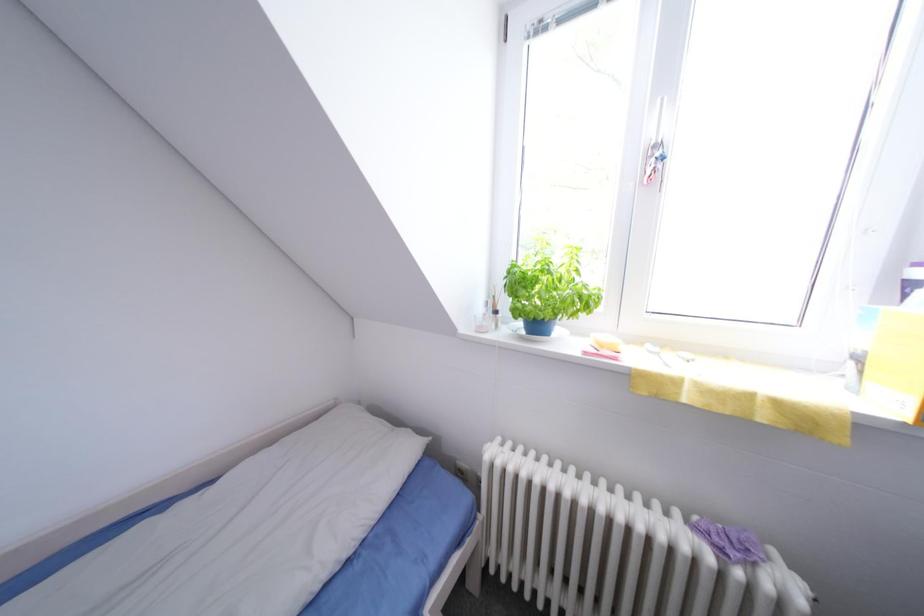
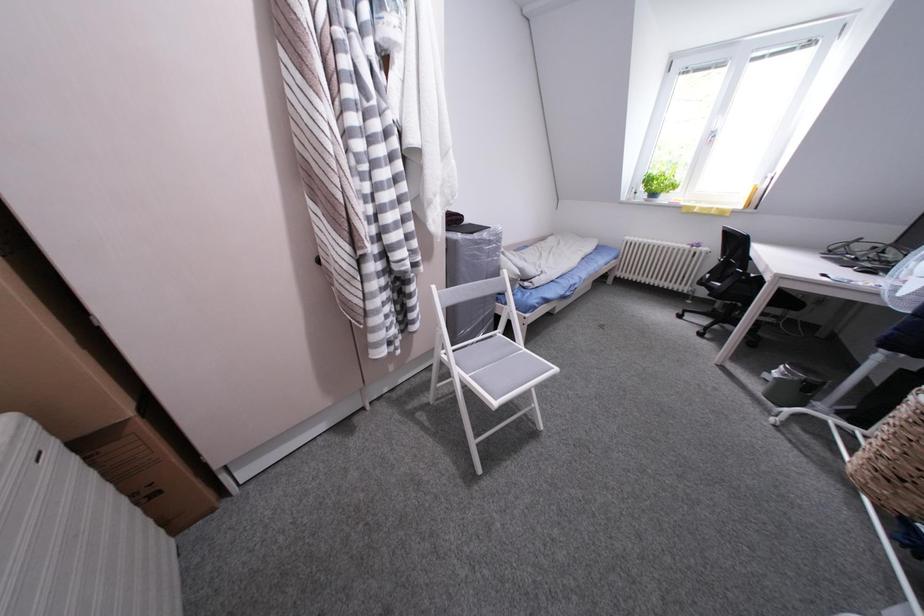
Looking at this image, what movement of the cameraman would produce the second image?

The cameraman walked toward left, backward.